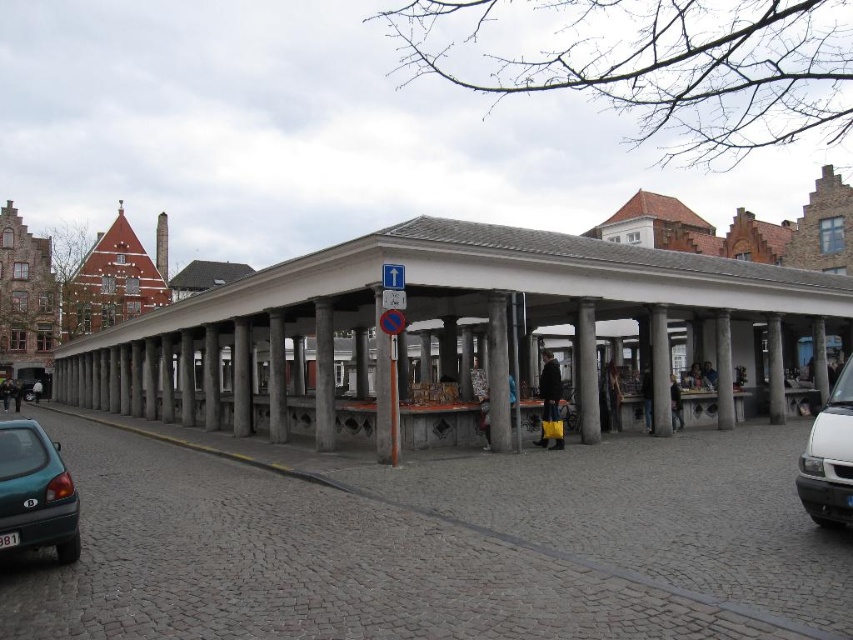
Question: Can you confirm if concrete pillars at center is positioned below white matte van at lower right?

Choices:
 (A) yes
 (B) no

Answer: (A)

Question: Does teal matte car at lower left appear on the right side of white matte van at lower right?

Choices:
 (A) no
 (B) yes

Answer: (A)

Question: Which point is closer to the camera taking this photo?

Choices:
 (A) (805, 467)
 (B) (723, 413)
 (C) (10, 515)

Answer: (C)

Question: Estimate the real-world distances between objects in this image. Which object is farther from the white matte van at lower right?

Choices:
 (A) teal matte car at lower left
 (B) concrete pillars at center

Answer: (B)

Question: Is concrete pillars at center to the left of white matte van at lower right from the viewer's perspective?

Choices:
 (A) no
 (B) yes

Answer: (B)

Question: Among these objects, which one is farthest from the camera?

Choices:
 (A) teal matte car at lower left
 (B) white matte van at lower right
 (C) concrete pillars at center

Answer: (C)